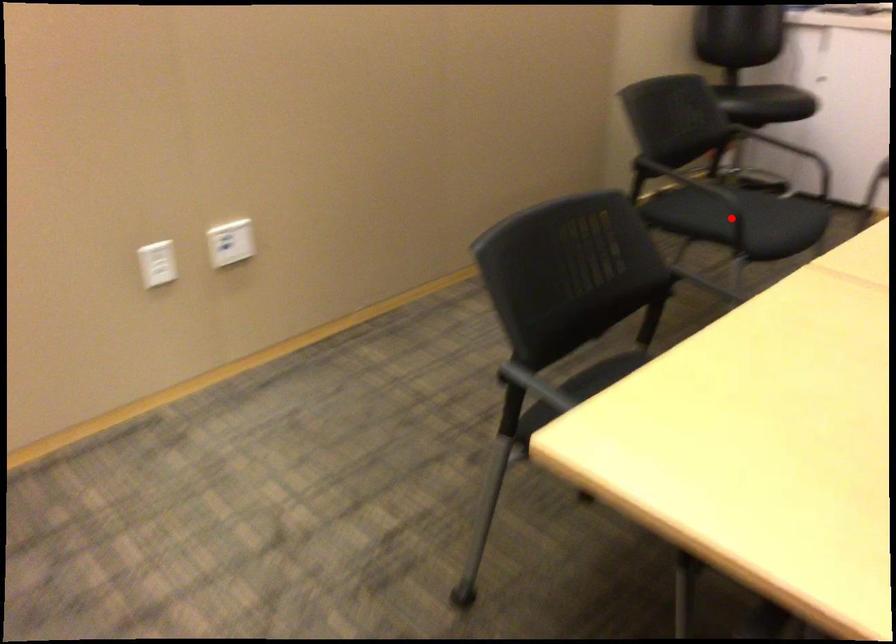
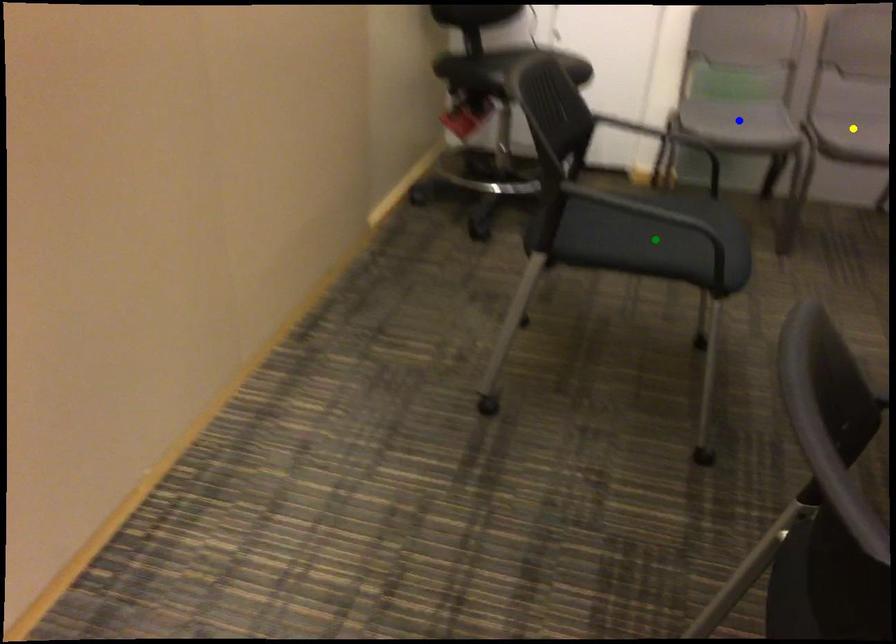
Question: I am providing you with two images of the same scene from different viewpoints. A red point is marked on the first image. You are given multiple points on the second image. Which point in image 2 represents the same 3d spot as the red point in image 1?

Choices:
 (A) blue point
 (B) green point
 (C) yellow point

Answer: (B)